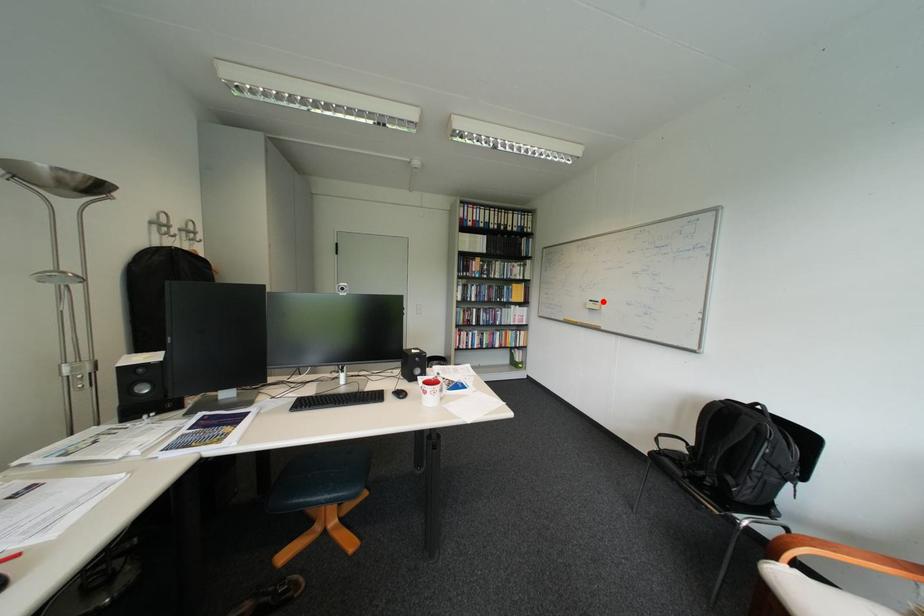
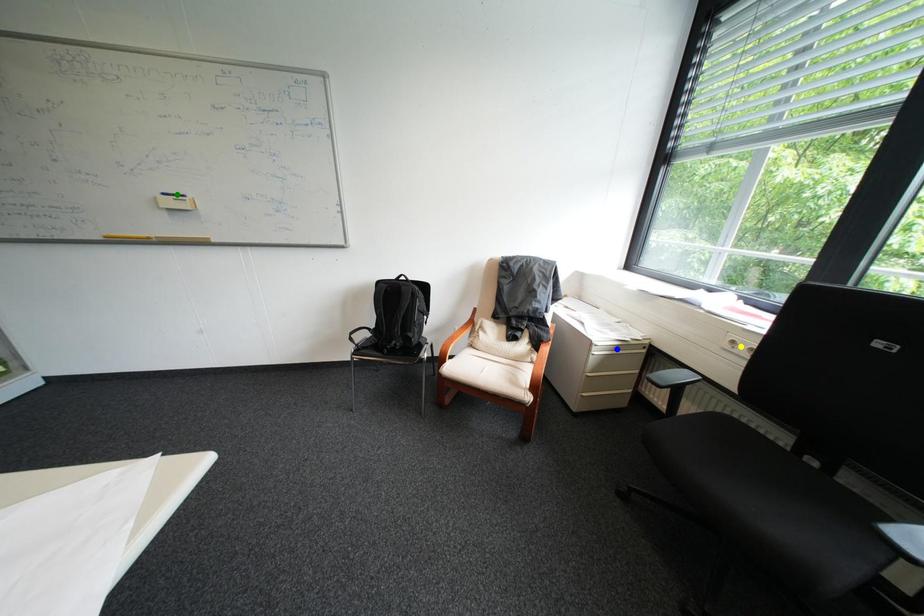
Question: I am providing you with two images of the same scene from different viewpoints. A red point is marked on the first image. You are given multiple points on the second image. Can you choose the point in image 2 that corresponds to the point in image 1?

Choices:
 (A) yellow point
 (B) green point
 (C) blue point

Answer: (B)